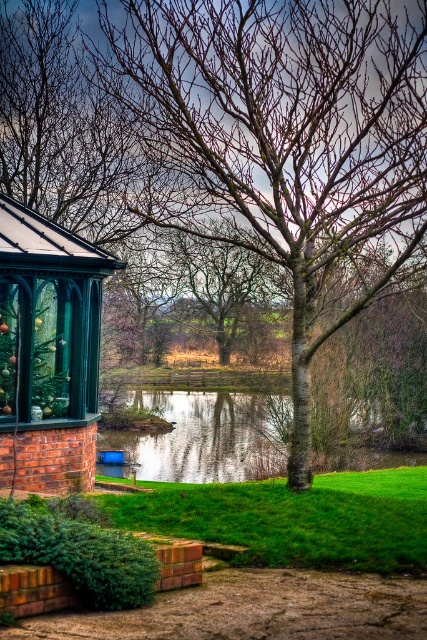
Question: Which point is farther from the camera taking this photo?

Choices:
 (A) (58, 428)
 (B) (240, 118)

Answer: (A)

Question: Is smooth bark tree at center thinner than reflective glass water at center?

Choices:
 (A) no
 (B) yes

Answer: (B)

Question: Which object appears closest to the camera in this image?

Choices:
 (A) bare branches at center
 (B) reflective glass water at center
 (C) smooth bark tree at center
 (D) matte green gazebo at left

Answer: (C)

Question: Is smooth bark tree at center thinner than reflective glass water at center?

Choices:
 (A) no
 (B) yes

Answer: (B)

Question: Can you confirm if smooth bark tree at center is bigger than bare branches at center?

Choices:
 (A) no
 (B) yes

Answer: (B)

Question: Considering the real-world distances, which object is closest to the matte green gazebo at left?

Choices:
 (A) bare branches at center
 (B) smooth bark tree at center
 (C) reflective glass water at center

Answer: (B)